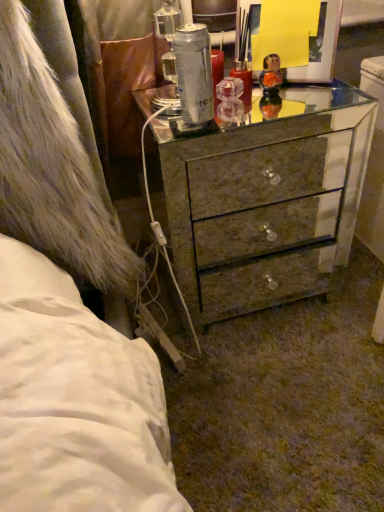
The height and width of the screenshot is (512, 384). In order to click on translucent glass figurine at upper center in this screenshot , I will do [x=271, y=74].

Measure the distance between translucent glass figurine at upper center and camera.

translucent glass figurine at upper center is 37.67 inches from camera.

Describe the element at coordinates (271, 74) in the screenshot. I see `translucent glass figurine at upper center` at that location.

Image resolution: width=384 pixels, height=512 pixels. Identify the location of metallic mirrored chest of drawers at center. (266, 200).

This screenshot has width=384, height=512. What do you see at coordinates (266, 200) in the screenshot?
I see `metallic mirrored chest of drawers at center` at bounding box center [266, 200].

Based on the photo, measure the distance between point (239, 133) and camera.

A distance of 3.51 feet exists between point (239, 133) and camera.

Identify the location of translucent glass figurine at upper center. (271, 74).

Does metallic mirrored chest of drawers at center appear on the left side of translucent glass figurine at upper center?

Yes.

Is metallic mirrored chest of drawers at center in front of or behind translucent glass figurine at upper center in the image?

In the image, metallic mirrored chest of drawers at center appears in front of translucent glass figurine at upper center.

Considering the points (178, 252) and (276, 54), which point is in front, point (178, 252) or point (276, 54)?

The point (276, 54) is closer.

From the image's perspective, is metallic mirrored chest of drawers at center over translucent glass figurine at upper center?

Actually, metallic mirrored chest of drawers at center appears below translucent glass figurine at upper center in the image.

From a real-world perspective, relative to translucent glass figurine at upper center, is metallic mirrored chest of drawers at center vertically above or below?

metallic mirrored chest of drawers at center is below translucent glass figurine at upper center.

From the picture: Between metallic mirrored chest of drawers at center and translucent glass figurine at upper center, which one has larger width?

Wider between the two is metallic mirrored chest of drawers at center.

Can you confirm if metallic mirrored chest of drawers at center is shorter than translucent glass figurine at upper center?

Incorrect, the height of metallic mirrored chest of drawers at center does not fall short of that of translucent glass figurine at upper center.

Does metallic mirrored chest of drawers at center have a smaller size compared to translucent glass figurine at upper center?

No.

Is metallic mirrored chest of drawers at center outside of translucent glass figurine at upper center?

metallic mirrored chest of drawers at center is positioned outside translucent glass figurine at upper center.

Is metallic mirrored chest of drawers at center placed right next to translucent glass figurine at upper center?

No, metallic mirrored chest of drawers at center is not next to translucent glass figurine at upper center.

Does metallic mirrored chest of drawers at center turn towards translucent glass figurine at upper center?

No, metallic mirrored chest of drawers at center is not facing towards translucent glass figurine at upper center.

This screenshot has width=384, height=512. What are the coordinates of `toy above the metallic mirrored chest of drawers at center (from a real-world perspective)` in the screenshot? It's located at (271, 74).

Is translucent glass figurine at upper center to the left of metallic mirrored chest of drawers at center from the viewer's perspective?

In fact, translucent glass figurine at upper center is to the right of metallic mirrored chest of drawers at center.

In the image, is translucent glass figurine at upper center positioned in front of or behind metallic mirrored chest of drawers at center?

Clearly, translucent glass figurine at upper center is behind metallic mirrored chest of drawers at center.

Which is in front, point (274, 56) or point (291, 210)?

Point (274, 56)

From the image's perspective, which object appears higher, translucent glass figurine at upper center or metallic mirrored chest of drawers at center?

From the image's view, translucent glass figurine at upper center is above.

From a real-world perspective, is translucent glass figurine at upper center positioned above or below metallic mirrored chest of drawers at center?

Clearly, from a real-world perspective, translucent glass figurine at upper center is above metallic mirrored chest of drawers at center.

Can you confirm if translucent glass figurine at upper center is thinner than metallic mirrored chest of drawers at center?

Indeed, translucent glass figurine at upper center has a lesser width compared to metallic mirrored chest of drawers at center.

Which of these two, translucent glass figurine at upper center or metallic mirrored chest of drawers at center, stands shorter?

translucent glass figurine at upper center is shorter.

In terms of size, does translucent glass figurine at upper center appear bigger or smaller than metallic mirrored chest of drawers at center?

Considering their sizes, translucent glass figurine at upper center takes up less space than metallic mirrored chest of drawers at center.

Consider the image. Is translucent glass figurine at upper center located outside metallic mirrored chest of drawers at center?

Yes, translucent glass figurine at upper center is located beyond the bounds of metallic mirrored chest of drawers at center.

Are translucent glass figurine at upper center and metallic mirrored chest of drawers at center making contact?

translucent glass figurine at upper center and metallic mirrored chest of drawers at center are not in contact.

Does translucent glass figurine at upper center turn towards metallic mirrored chest of drawers at center?

No, translucent glass figurine at upper center does not turn towards metallic mirrored chest of drawers at center.

Can you tell me how much translucent glass figurine at upper center and metallic mirrored chest of drawers at center differ in facing direction?

translucent glass figurine at upper center and metallic mirrored chest of drawers at center are facing 4.17 degrees away from each other.

In the scene shown: How far apart are translucent glass figurine at upper center and metallic mirrored chest of drawers at center?

A distance of 19.79 inches exists between translucent glass figurine at upper center and metallic mirrored chest of drawers at center.

Locate an element on the screen. This screenshot has height=512, width=384. chest of drawers on the left side of translucent glass figurine at upper center is located at coordinates (266, 200).

This screenshot has height=512, width=384. Identify the location of chest of drawers below the translucent glass figurine at upper center (from the image's perspective). (266, 200).

Find the location of `toy lying on the right of metallic mirrored chest of drawers at center`. toy lying on the right of metallic mirrored chest of drawers at center is located at coordinates (271, 74).